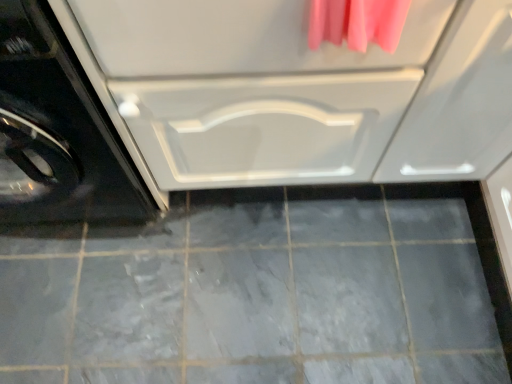
Question: Is black glossy washing machine at left bigger than white glossy drawer at center?

Choices:
 (A) yes
 (B) no

Answer: (B)

Question: Considering the relative sizes of black glossy washing machine at left and white glossy drawer at center in the image provided, is black glossy washing machine at left thinner than white glossy drawer at center?

Choices:
 (A) no
 (B) yes

Answer: (A)

Question: Considering the relative sizes of black glossy washing machine at left and white glossy drawer at center in the image provided, is black glossy washing machine at left smaller than white glossy drawer at center?

Choices:
 (A) no
 (B) yes

Answer: (B)

Question: Is black glossy washing machine at left looking in the opposite direction of white glossy drawer at center?

Choices:
 (A) no
 (B) yes

Answer: (A)

Question: Does black glossy washing machine at left have a greater width compared to white glossy drawer at center?

Choices:
 (A) no
 (B) yes

Answer: (B)

Question: Is the depth of black glossy washing machine at left greater than that of white glossy drawer at center?

Choices:
 (A) no
 (B) yes

Answer: (A)

Question: From the image's perspective, is gray matte tile at center located beneath black glossy washing machine at left?

Choices:
 (A) no
 (B) yes

Answer: (B)

Question: Would you say gray matte tile at center is outside black glossy washing machine at left?

Choices:
 (A) yes
 (B) no

Answer: (A)

Question: Is gray matte tile at center positioned with its back to black glossy washing machine at left?

Choices:
 (A) yes
 (B) no

Answer: (B)

Question: Considering the relative sizes of gray matte tile at center and black glossy washing machine at left in the image provided, is gray matte tile at center wider than black glossy washing machine at left?

Choices:
 (A) no
 (B) yes

Answer: (B)

Question: From the image's perspective, does gray matte tile at center appear higher than black glossy washing machine at left?

Choices:
 (A) no
 (B) yes

Answer: (A)

Question: Is gray matte tile at center at the left side of black glossy washing machine at left?

Choices:
 (A) yes
 (B) no

Answer: (B)

Question: Is white glossy drawer at center looking in the opposite direction of black glossy washing machine at left?

Choices:
 (A) no
 (B) yes

Answer: (A)